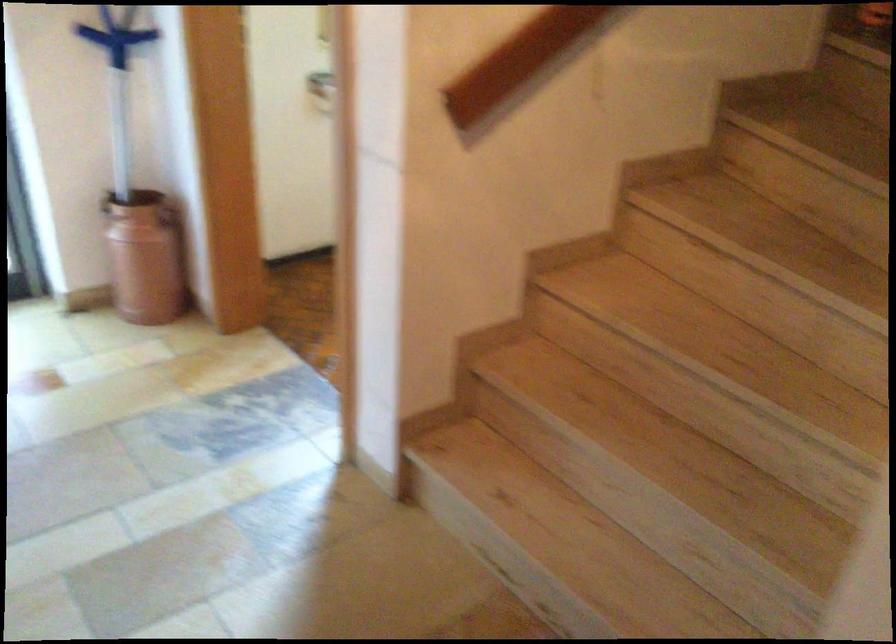
Find where to grasp the blue cleaning tool. Please return your answer as a coordinate pair (x, y).

(117, 82)